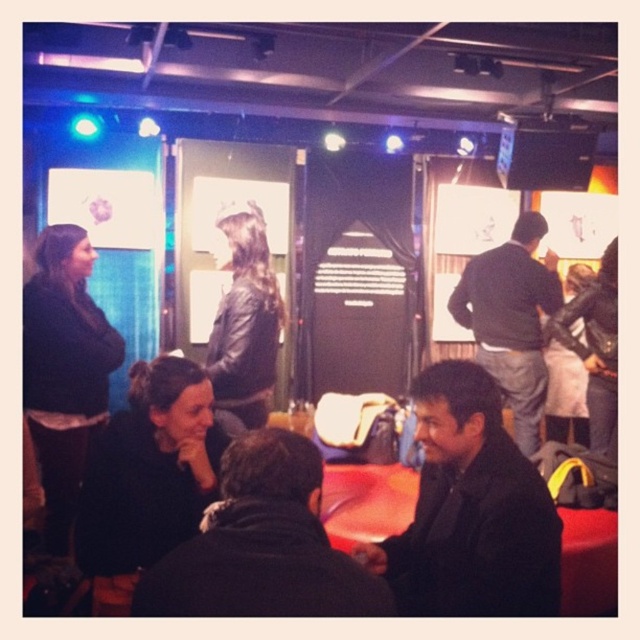
You are standing in the scene and want to move from the black matte jacket at lower right to the dark gray sweater at center. Which direction should you move to reach it?

To move from the black matte jacket at lower right to the dark gray sweater at center, you should move to the left since the black matte jacket at lower right is positioned to the left of the dark gray sweater at center.

Looking at this image, you are a guest at this event and need to move from the black matte jacket at lower right to the dark brown leather jacket at lower center. Can you walk directly between them without needing to detour?

The distance between the black matte jacket at lower right and the dark brown leather jacket at lower center is 24.45 inches. Since this distance is quite narrow, it would be difficult to walk directly between them without needing to detour.